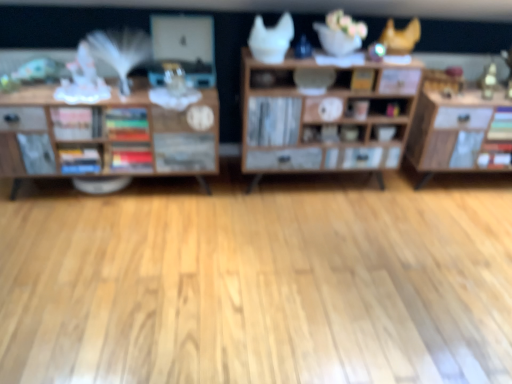
Locate an element on the screen. This screenshot has height=384, width=512. hardcover books at center, which is the second book from left to right is located at coordinates (131, 157).

Describe the element at coordinates (131, 157) in the screenshot. I see `hardcover books at center, which is the second book from left to right` at that location.

Identify the location of wooden bookshelf at left, marked as the second shelf in a right-to-left arrangement. (104, 134).

This screenshot has width=512, height=384. Describe the element at coordinates (127, 124) in the screenshot. I see `multicolored hardcover books at center, which appears as the third book when viewed from the left` at that location.

Image resolution: width=512 pixels, height=384 pixels. Describe the element at coordinates (322, 116) in the screenshot. I see `wooden cabinet at center, the first shelf positioned from the right` at that location.

What is the approximate width of matte white bowl at center?

It is 6.64 inches.

Image resolution: width=512 pixels, height=384 pixels. Identify the location of hardcover books at center, placed as the 3th book when sorted from right to left. (131, 157).

Which is less distant, (384, 138) or (121, 148)?

Point (384, 138).

Which of these two, matte white bowl at center or hardcover books at center, which is the second book from left to right, is thinner?

hardcover books at center, which is the second book from left to right.

Is matte white bowl at center turned away from hardcover books at center, placed as the 3th book when sorted from right to left?

No, hardcover books at center, placed as the 3th book when sorted from right to left, is not at the back of matte white bowl at center.

I want to click on cabinet lying above the hardcover books at center, which is the second book from left to right (from the image's perspective), so click(x=386, y=132).

Can you confirm if wooden bookshelf at left, the 1th shelf positioned from the left, is wider than wooden cabinet at center, the first shelf positioned from the right?

In fact, wooden bookshelf at left, the 1th shelf positioned from the left, might be narrower than wooden cabinet at center, the first shelf positioned from the right.

Based on the photo, how different are the orientations of wooden bookshelf at left, the 1th shelf positioned from the left, and wooden cabinet at center, the second shelf when ordered from left to right, in degrees?

0.62 degrees.

From the image's perspective, is wooden bookshelf at left, the 1th shelf positioned from the left, above or below wooden cabinet at center, the first shelf positioned from the right?

Clearly, from the image's perspective, wooden bookshelf at left, the 1th shelf positioned from the left, is below wooden cabinet at center, the first shelf positioned from the right.

Does point (15, 192) lie behind point (298, 64)?

Yes, it is.

Looking at their sizes, would you say hardcover books at center, which is the second book from left to right, is wider or thinner than matte white bowl at center?

Clearly, hardcover books at center, which is the second book from left to right, has less width compared to matte white bowl at center.

Is hardcover books at center, placed as the 3th book when sorted from right to left, spatially inside matte white bowl at center, or outside of it?

The correct answer is: outside.

Does hardcover books at center, placed as the 3th book when sorted from right to left, touch matte white bowl at center?

No, hardcover books at center, placed as the 3th book when sorted from right to left, is not in contact with matte white bowl at center.

From a real-world perspective, is hardcover books at center, which is the second book from left to right, physically below matte white bowl at center?

Yes.

From a real-world perspective, is hardcover books at center, which is the second book from left to right, physically above multicolored hardcover books at center, which appears as the third book when viewed from the left?

No.

Is hardcover books at center, placed as the 3th book when sorted from right to left, at the left side of multicolored hardcover books at center, which appears as the third book when viewed from the left?

Correct, you'll find hardcover books at center, placed as the 3th book when sorted from right to left, to the left of multicolored hardcover books at center, which appears as the third book when viewed from the left.

From the image's perspective, between hardcover books at center, which is the second book from left to right, and multicolored hardcover books at center, which appears as the third book when viewed from the left, which one is located above?

multicolored hardcover books at center, which appears as the third book when viewed from the left, is shown above in the image.

Considering the sizes of objects wooden bookshelf at left, the 1th shelf positioned from the left, and hardcover books at center, placed as the 3th book when sorted from right to left, in the image provided, who is thinner, wooden bookshelf at left, the 1th shelf positioned from the left, or hardcover books at center, placed as the 3th book when sorted from right to left,?

Thinner between the two is hardcover books at center, placed as the 3th book when sorted from right to left.

What's the angular difference between wooden bookshelf at left, the 1th shelf positioned from the left, and hardcover books at center, placed as the 3th book when sorted from right to left,'s facing directions?

The angle between the facing direction of wooden bookshelf at left, the 1th shelf positioned from the left, and the facing direction of hardcover books at center, placed as the 3th book when sorted from right to left, is 0.153 degrees.

Identify the location of the 1st book to the right of the wooden bookshelf at left, marked as the second shelf in a right-to-left arrangement, counting from the anchor's position. (131, 157).

Which point is more distant from viewer, (203,132) or (133,167)?

The point (133,167) is farther.

From the picture: Which is more to the left, hardcover book at left, placed as the 1th book when sorted from left to right, or hardcover books at center, placed as the 3th book when sorted from right to left?

Positioned to the left is hardcover book at left, placed as the 1th book when sorted from left to right.

From the image's perspective, which book is the 1st one above the hardcover book at left, which is the fourth book from right to left? Please provide its 2D coordinates.

[(131, 157)]

In terms of size, does hardcover book at left, which is the fourth book from right to left, appear bigger or smaller than hardcover books at center, placed as the 3th book when sorted from right to left?

Considering their sizes, hardcover book at left, which is the fourth book from right to left, takes up less space than hardcover books at center, placed as the 3th book when sorted from right to left.

From a real-world perspective, between hardcover book at left, which is the fourth book from right to left, and hardcover books at center, which is the second book from left to right, who is vertically lower?

hardcover books at center, which is the second book from left to right, from a real-world perspective.

Is hardcover book at left, placed as the 1th book when sorted from left to right, further to camera compared to wooden bookshelf at left, the 1th shelf positioned from the left?

Yes.

Considering the sizes of objects hardcover book at left, which is the fourth book from right to left, and wooden bookshelf at left, marked as the second shelf in a right-to-left arrangement, in the image provided, who is bigger, hardcover book at left, which is the fourth book from right to left, or wooden bookshelf at left, marked as the second shelf in a right-to-left arrangement,?

Bigger between the two is wooden bookshelf at left, marked as the second shelf in a right-to-left arrangement.

Can you tell me how much hardcover book at left, placed as the 1th book when sorted from left to right, and wooden bookshelf at left, marked as the second shelf in a right-to-left arrangement, differ in facing direction?

The angle between the facing direction of hardcover book at left, placed as the 1th book when sorted from left to right, and the facing direction of wooden bookshelf at left, marked as the second shelf in a right-to-left arrangement, is 0.153 degrees.

The image size is (512, 384). In order to click on the 2nd book below the matte white bowl at center (from a real-world perspective) in this screenshot , I will do `click(131, 157)`.

I want to click on shelf lying on the right of wooden bookshelf at left, the 1th shelf positioned from the left, so click(322, 116).

Estimate the real-world distances between objects in this image. Which object is closer to matte white bowl at center, hardcover book at left, which is the fourth book from right to left, or hardcover books at center, which is the second book from left to right?

hardcover books at center, which is the second book from left to right, lies closer to matte white bowl at center than the other object.

Based on their spatial positions, is hardcover book at left, which is the fourth book from right to left, or yellow matte book at center, the 4th book when ordered from left to right, closer to matte white bowl at center?

Based on the image, yellow matte book at center, the 4th book when ordered from left to right, appears to be nearer to matte white bowl at center.

Looking at the image, which one is located further to wooden bookshelf at left, marked as the second shelf in a right-to-left arrangement, matte white bowl at center or hardcover books at center, which is the second book from left to right?

matte white bowl at center is positioned further to the anchor wooden bookshelf at left, marked as the second shelf in a right-to-left arrangement.

Looking at the image, which one is located further to wooden bookshelf at left, the 1th shelf positioned from the left, wooden cabinet at center, the first shelf positioned from the right, or hardcover book at left, placed as the 1th book when sorted from left to right?

wooden cabinet at center, the first shelf positioned from the right, is positioned further to the anchor wooden bookshelf at left, the 1th shelf positioned from the left.

When comparing their distances from hardcover books at center, placed as the 3th book when sorted from right to left, does wooden cabinet at center, the second shelf when ordered from left to right, or matte white bowl at center seem further?

Based on the image, matte white bowl at center appears to be further to hardcover books at center, placed as the 3th book when sorted from right to left.

Considering their positions, is matte white bowl at center positioned closer to wooden cabinet at center, the second shelf when ordered from left to right, than hardcover book at left, placed as the 1th book when sorted from left to right?

matte white bowl at center.

Estimate the real-world distances between objects in this image. Which object is closer to wooden cabinet at center, the second shelf when ordered from left to right, wooden bookshelf at left, the 1th shelf positioned from the left, or hardcover book at left, placed as the 1th book when sorted from left to right?

wooden bookshelf at left, the 1th shelf positioned from the left, lies closer to wooden cabinet at center, the second shelf when ordered from left to right, than the other object.

Estimate the real-world distances between objects in this image. Which object is further from wooden cabinet at center, the first shelf positioned from the right, wooden bookshelf at left, the 1th shelf positioned from the left, or hardcover books at center, placed as the 3th book when sorted from right to left?

Based on the image, hardcover books at center, placed as the 3th book when sorted from right to left, appears to be further to wooden cabinet at center, the first shelf positioned from the right.

Locate an element on the screen. This screenshot has width=512, height=384. shelf between wooden bookshelf at left, marked as the second shelf in a right-to-left arrangement, and yellow matte book at center, the 4th book when ordered from left to right, from left to right is located at coordinates (322, 116).

Where is `shelf between hardcover book at left, placed as the 1th book when sorted from left to right, and multicolored hardcover books at center, which appears as the third book when viewed from the left`? The height and width of the screenshot is (384, 512). shelf between hardcover book at left, placed as the 1th book when sorted from left to right, and multicolored hardcover books at center, which appears as the third book when viewed from the left is located at coordinates (104, 134).

Where is `book situated between hardcover books at center, placed as the 3th book when sorted from right to left, and wooden cabinet at center, the first shelf positioned from the right, from left to right`? The height and width of the screenshot is (384, 512). book situated between hardcover books at center, placed as the 3th book when sorted from right to left, and wooden cabinet at center, the first shelf positioned from the right, from left to right is located at coordinates (127, 124).

The image size is (512, 384). I want to click on shelf situated between hardcover books at center, which is the second book from left to right, and yellow matte book at center, the 4th book when ordered from left to right, from left to right, so click(x=322, y=116).